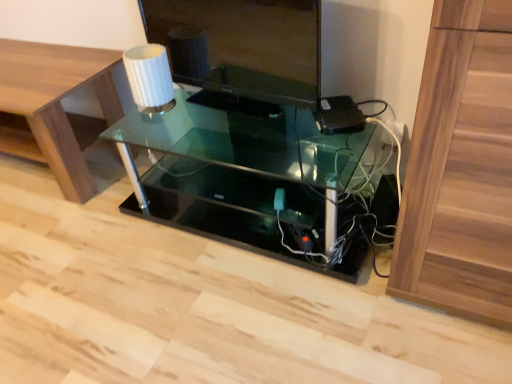
Question: Considering the relative sizes of white ribbed glass at upper center and matte black monitor at center in the image provided, is white ribbed glass at upper center bigger than matte black monitor at center?

Choices:
 (A) yes
 (B) no

Answer: (B)

Question: Considering the relative sizes of white ribbed glass at upper center and matte black monitor at center in the image provided, is white ribbed glass at upper center wider than matte black monitor at center?

Choices:
 (A) no
 (B) yes

Answer: (B)

Question: Is white ribbed glass at upper center not near matte black monitor at center?

Choices:
 (A) no
 (B) yes

Answer: (A)

Question: Is the position of white ribbed glass at upper center more distant than that of matte black monitor at center?

Choices:
 (A) yes
 (B) no

Answer: (A)

Question: Considering the relative positions of white ribbed glass at upper center and matte black monitor at center in the image provided, is white ribbed glass at upper center in front of matte black monitor at center?

Choices:
 (A) yes
 (B) no

Answer: (B)

Question: Choose the correct answer: Is matte black monitor at center inside transparent glass table at center or outside it?

Choices:
 (A) outside
 (B) inside

Answer: (A)

Question: From their relative heights in the image, would you say matte black monitor at center is taller or shorter than transparent glass table at center?

Choices:
 (A) tall
 (B) short

Answer: (A)

Question: Is matte black monitor at center wider or thinner than transparent glass table at center?

Choices:
 (A) thin
 (B) wide

Answer: (A)

Question: In the image, is matte black monitor at center on the left side or the right side of transparent glass table at center?

Choices:
 (A) left
 (B) right

Answer: (A)

Question: Considering the positions of wooden table at lower left and matte black monitor at center in the image, is wooden table at lower left taller or shorter than matte black monitor at center?

Choices:
 (A) short
 (B) tall

Answer: (B)

Question: Visually, is wooden table at lower left positioned to the left or to the right of matte black monitor at center?

Choices:
 (A) right
 (B) left

Answer: (B)

Question: In terms of size, does wooden table at lower left appear bigger or smaller than matte black monitor at center?

Choices:
 (A) small
 (B) big

Answer: (B)

Question: Is point [x=41, y=122] closer or farther from the camera than point [x=224, y=6]?

Choices:
 (A) farther
 (B) closer

Answer: (A)

Question: Is white ribbed glass at upper center to the left or to the right of matte black monitor at center in the image?

Choices:
 (A) right
 (B) left

Answer: (B)

Question: Is white ribbed glass at upper center taller or shorter than matte black monitor at center?

Choices:
 (A) tall
 (B) short

Answer: (B)